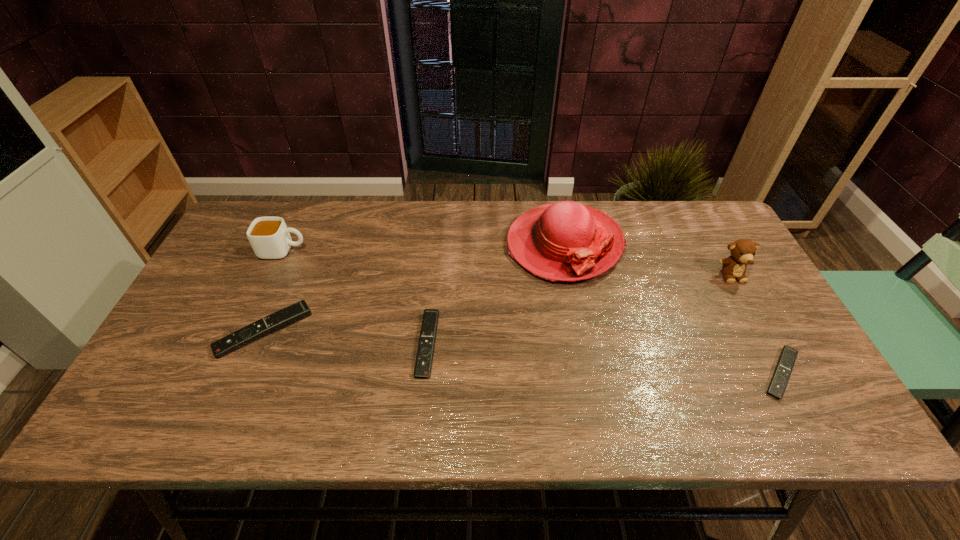
Find the location of a particular element. The image size is (960, 540). object that can be found as the fifth closest to the tallest remote control is located at coordinates point(743,251).

Identify the location of remote control that can be found as the closest to the rightmost remote control. point(423,364).

Locate which remote control is the third closest to the cup. Please provide its 2D coordinates. Your answer should be formatted as a tuple, i.e. [(x, y)], where the tuple contains the x and y coordinates of a point satisfying the conditions above.

[(788, 355)]

Locate an element on the screen. The width and height of the screenshot is (960, 540). vacant area that satisfies the following two spatial constraints: 1. on the side with the handle of the fourth shortest object; 2. on the back side of the second shortest remote control is located at coordinates (241, 344).

This screenshot has width=960, height=540. I want to click on vacant space that satisfies the following two spatial constraints: 1. on the side with the handle of the fourth shortest object; 2. on the back side of the second remote control from right to left, so click(241, 344).

This screenshot has width=960, height=540. I want to click on free space that satisfies the following two spatial constraints: 1. on the front side of the shortest remote control; 2. on the left side of the leftmost remote control, so click(246, 374).

Find the location of a particular element. vacant area that satisfies the following two spatial constraints: 1. on the side with the handle of the cup; 2. on the back side of the second tallest remote control is located at coordinates (241, 344).

The height and width of the screenshot is (540, 960). Find the location of `vacant space that satisfies the following two spatial constraints: 1. at the front of the tallest object with a bow; 2. on the right side of the shortest remote control`. vacant space that satisfies the following two spatial constraints: 1. at the front of the tallest object with a bow; 2. on the right side of the shortest remote control is located at coordinates (589, 374).

At what (x,y) coordinates should I click in order to perform the action: click on free spot that satisfies the following two spatial constraints: 1. on the side with the handle of the cup; 2. on the back side of the rightmost remote control. Please return your answer as a coordinate pair (x, y). This screenshot has width=960, height=540. Looking at the image, I should click on (228, 374).

Where is `free space in the image that satisfies the following two spatial constraints: 1. on the side with the handle of the cup; 2. on the left side of the fourth object from right to left`? The height and width of the screenshot is (540, 960). free space in the image that satisfies the following two spatial constraints: 1. on the side with the handle of the cup; 2. on the left side of the fourth object from right to left is located at coordinates (241, 344).